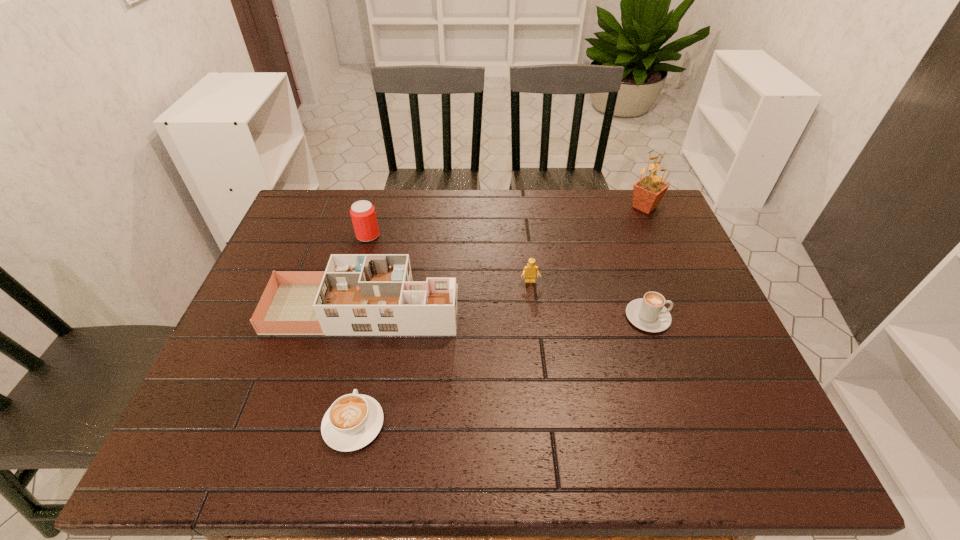
What are the coordinates of `object that ranks as the third closest to the sunflower` in the screenshot? It's located at (358, 294).

Where is `object that stands as the closest to the shortest object`? This screenshot has height=540, width=960. object that stands as the closest to the shortest object is located at coordinates (358, 294).

This screenshot has height=540, width=960. I want to click on vacant space that satisfies the following two spatial constraints: 1. at the front of the farthest object with flowers visible; 2. on the face of the fourth object from left to right, so click(678, 282).

Locate an element on the screen. This screenshot has width=960, height=540. vacant region that satisfies the following two spatial constraints: 1. at the front of the tallest object with flowers visible; 2. on the face of the fourth tallest object is located at coordinates (678, 282).

This screenshot has height=540, width=960. Identify the location of vacant region that satisfies the following two spatial constraints: 1. on the side of the shortest object with the handle; 2. at the entrance of the dollhouse. (378, 308).